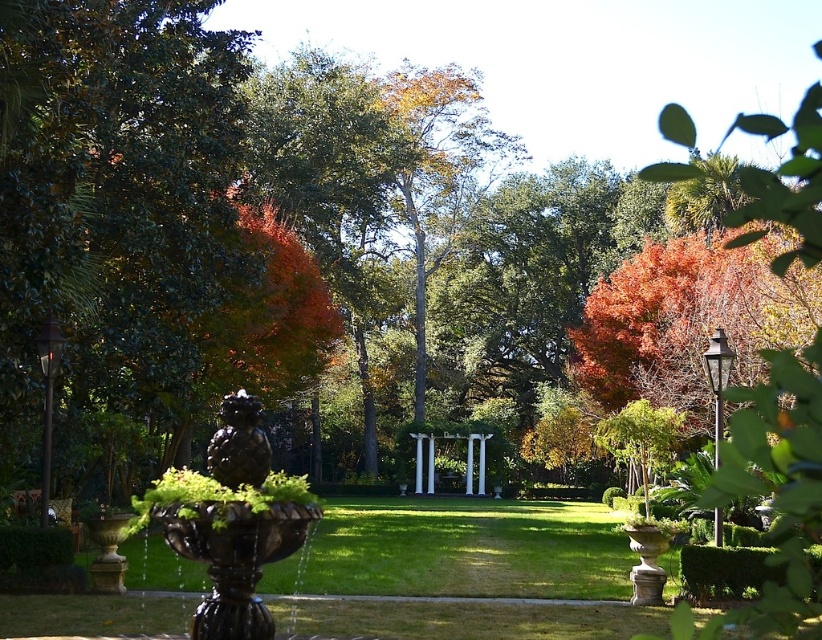
Question: Which of the following is the farthest from the observer?

Choices:
 (A) (241, 317)
 (B) (158, 504)
 (C) (30, 435)
 (D) (239, 470)

Answer: (A)

Question: Can you confirm if bronze/textured fountain at center is positioned to the left of shiny red leaves at center?

Choices:
 (A) yes
 (B) no

Answer: (B)

Question: Can you confirm if green leafy tree at left is wider than bronze statue at center?

Choices:
 (A) no
 (B) yes

Answer: (B)

Question: Which point is closer to the camera?

Choices:
 (A) bronze/textured fountain at center
 (B) shiny red leaves at center
 (C) green leafy tree at left
 (D) bronze statue at center

Answer: (D)

Question: Does bronze/textured fountain at center have a lesser width compared to shiny red leaves at center?

Choices:
 (A) yes
 (B) no

Answer: (A)

Question: Which object is the closest to the bronze/textured fountain at center?

Choices:
 (A) shiny red leaves at center
 (B) green leafy tree at left
 (C) bronze statue at center

Answer: (C)